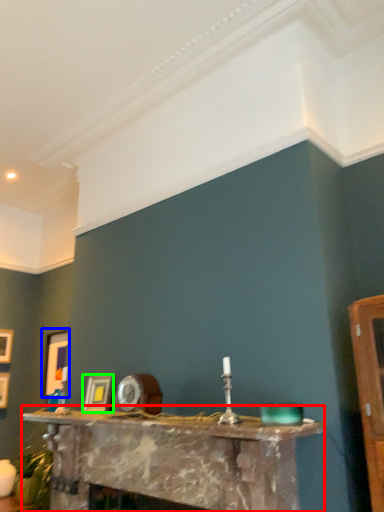
Question: Considering the real-world distances, which object is closest to table (highlighted by a red box)? picture frame (highlighted by a blue box) or picture frame (highlighted by a green box).

Choices:
 (A) picture frame
 (B) picture frame

Answer: (B)